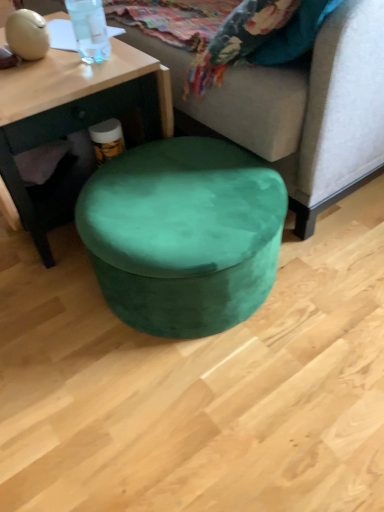
The image size is (384, 512). I want to click on free space to the right of velvet green ottoman at center, so click(x=337, y=272).